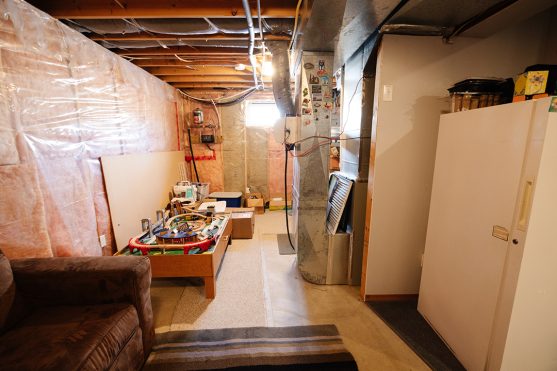
The image size is (557, 371). I want to click on wall, so click(x=411, y=185).